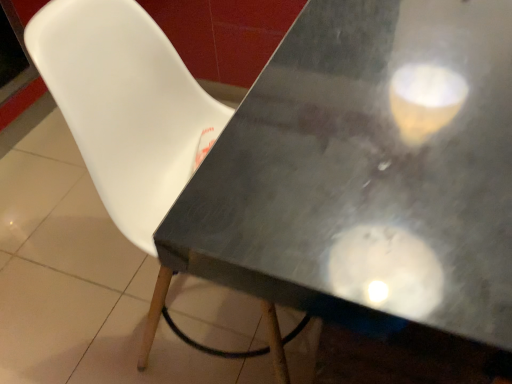
Locate an element on the screen. The image size is (512, 384). free space to the left of white plastic chair at center is located at coordinates (92, 309).